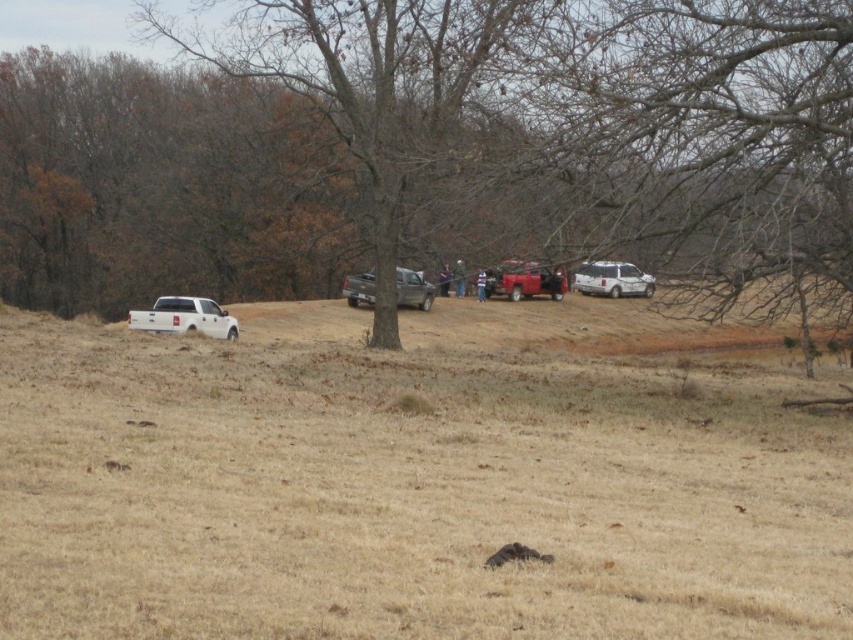
Question: Considering the real-world distances, which object is farthest from the striped shirt at center?

Choices:
 (A) white matte suv at center-right
 (B) metallic gray truck at center
 (C) metallic red truck at center
 (D) blue jeans at center

Answer: (B)

Question: Which point is closer to the camera?

Choices:
 (A) brown grassy field at lower center
 (B) metallic gray truck at center
 (C) blue jeans at center
 (D) striped shirt at center

Answer: (A)

Question: Which is farther from the white matte suv at center-right?

Choices:
 (A) metallic gray truck at center
 (B) white matte truck at left
 (C) brown bark tree at center
 (D) brown grassy field at lower center

Answer: (B)

Question: Can you confirm if brown grassy field at lower center is positioned to the left of white matte suv at center-right?

Choices:
 (A) yes
 (B) no

Answer: (A)

Question: Is brown grassy field at lower center positioned behind metallic gray truck at center?

Choices:
 (A) no
 (B) yes

Answer: (A)

Question: Considering the relative positions of white matte suv at center-right and striped shirt at center in the image provided, where is white matte suv at center-right located with respect to striped shirt at center?

Choices:
 (A) left
 (B) right

Answer: (B)